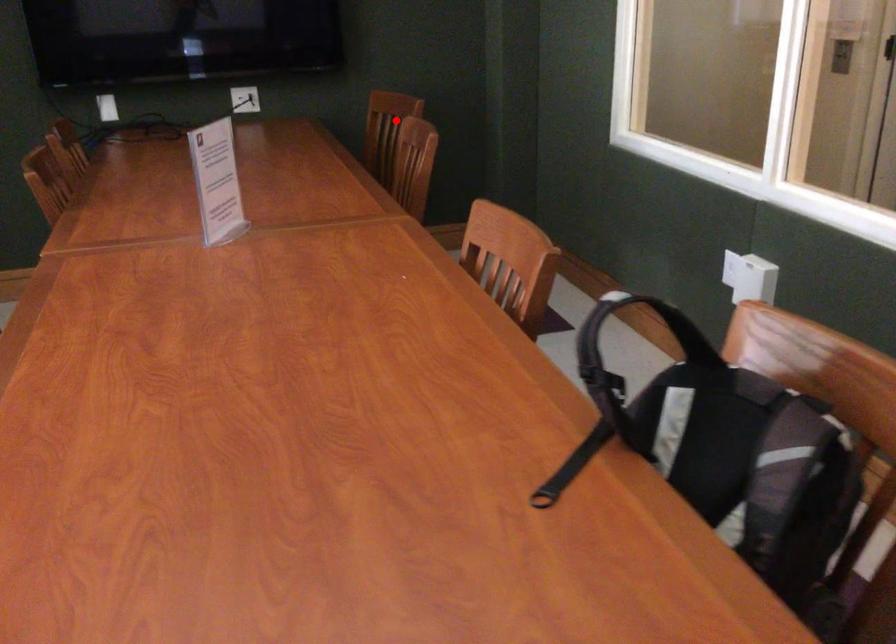
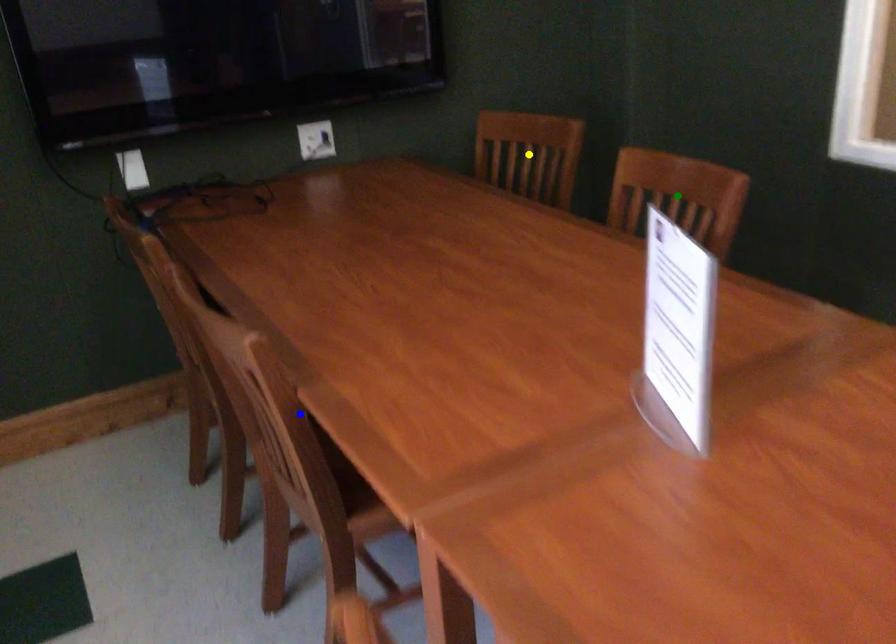
Question: I am providing you with two images of the same scene from different viewpoints. A red point is marked on the first image. You are given multiple points on the second image. Which point in image 2 represents the same 3d spot as the red point in image 1?

Choices:
 (A) yellow point
 (B) green point
 (C) blue point

Answer: (A)